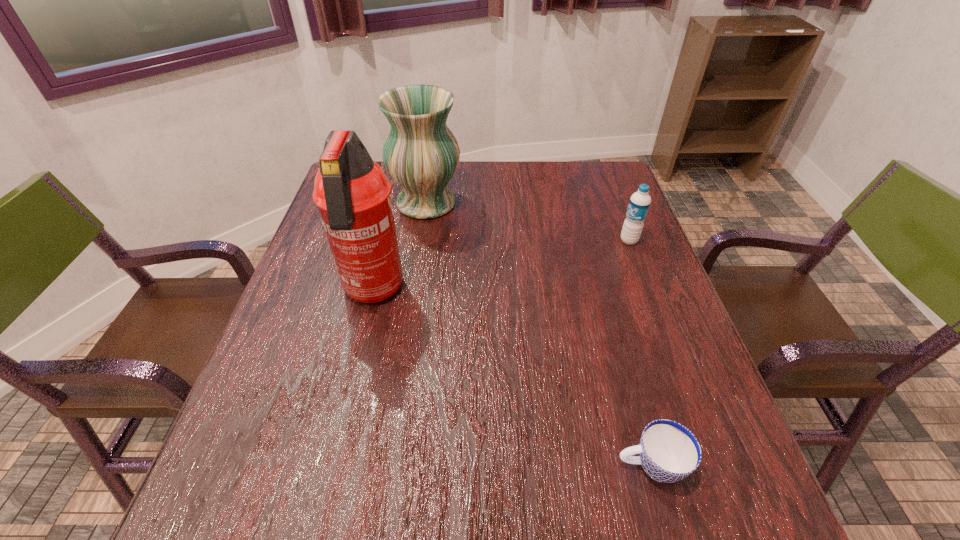
The width and height of the screenshot is (960, 540). I want to click on free space that is in between the third object from left to right and the water bottle, so click(x=639, y=353).

Locate an element on the screen. Image resolution: width=960 pixels, height=540 pixels. free point between the water bottle and the second nearest object is located at coordinates (501, 266).

You are a GUI agent. You are given a task and a screenshot of the screen. Output one action in this format:
    pyautogui.click(x=<x>, y=<y>)
    Task: Click on the free point between the water bottle and the second nearest object
    
    Given the screenshot: What is the action you would take?
    pyautogui.click(x=501, y=266)

You are a GUI agent. You are given a task and a screenshot of the screen. Output one action in this format:
    pyautogui.click(x=<x>, y=<y>)
    Task: Click on the vacant area that lies between the nearest object and the rightmost object
    The image size is (960, 540).
    Given the screenshot: What is the action you would take?
    pyautogui.click(x=639, y=353)

The width and height of the screenshot is (960, 540). Identify the location of free area in between the second object from right to left and the third shortest object. (539, 334).

Identify the location of vacant space that's between the vase and the water bottle. (528, 222).

Locate an element on the screen. free space between the rightmost object and the fire extinguisher is located at coordinates (501, 266).

Point out which object is positioned as the nearest to the vase. Please provide its 2D coordinates. Your answer should be formatted as a tuple, i.e. [(x, y)], where the tuple contains the x and y coordinates of a point satisfying the conditions above.

[(352, 193)]

Identify the location of object that can be found as the closest to the vase. The width and height of the screenshot is (960, 540). (352, 193).

Identify the location of vacant area that satisfies the following two spatial constraints: 1. on the label of the second farthest object; 2. on the trigger side of the fire extinguisher. (649, 292).